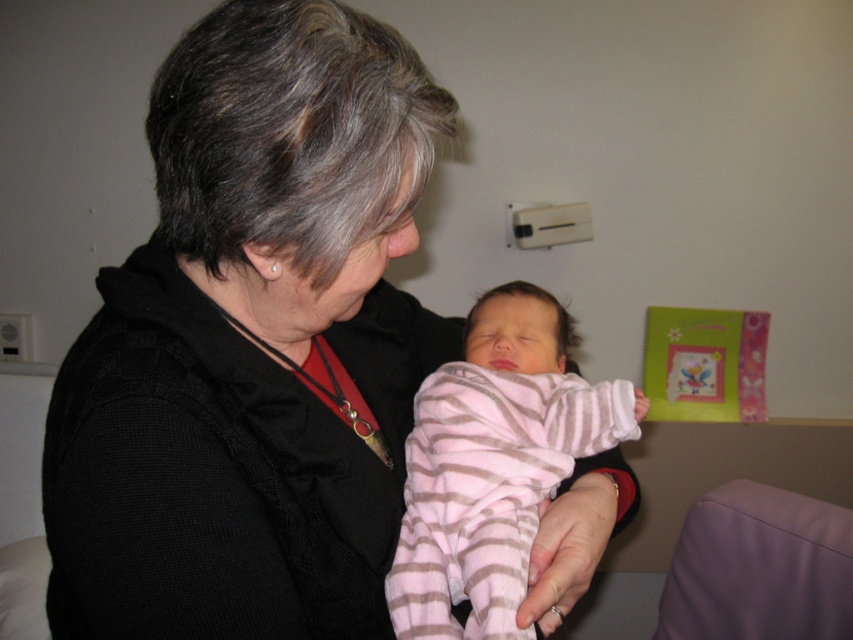
Question: Where is pink striped fabric baby at center located in relation to purple fabric couch at lower right in the image?

Choices:
 (A) right
 (B) left

Answer: (B)

Question: Where is pink striped fabric baby at center located in relation to pink soft fabric at lower center in the image?

Choices:
 (A) left
 (B) right

Answer: (A)

Question: Which point appears farthest from the camera in this image?

Choices:
 (A) click(x=473, y=353)
 (B) click(x=712, y=618)
 (C) click(x=160, y=124)

Answer: (B)

Question: Estimate the real-world distances between objects in this image. Which object is farther from the pink soft fabric at lower center?

Choices:
 (A) pink striped fabric at center
 (B) black soft sweater at center

Answer: (B)

Question: Which point is closer to the camera taking this photo?

Choices:
 (A) (x=578, y=540)
 (B) (x=785, y=595)
 (C) (x=556, y=541)
 (D) (x=341, y=408)

Answer: (C)

Question: Does black soft sweater at center come behind purple fabric couch at lower right?

Choices:
 (A) no
 (B) yes

Answer: (A)